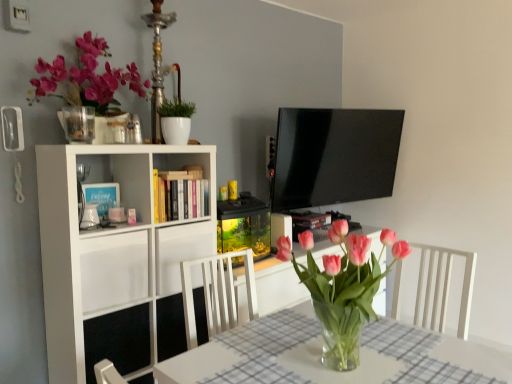
Question: From a real-world perspective, is white glossy pot at upper center above or below pink glass vase at center?

Choices:
 (A) above
 (B) below

Answer: (A)

Question: In the image, is white glossy pot at upper center on the left side or the right side of pink glass vase at center?

Choices:
 (A) right
 (B) left

Answer: (B)

Question: Which is farther from the clear glass vase at center?

Choices:
 (A) matte pink flowers at upper left
 (B) white matte cabinet at left, the first cabinet in the left-to-right sequence
 (C) pink glass vase at center
 (D) hardcover books at center
 (E) white matte cabinet at center, which is the first cabinet from right to left

Answer: (A)

Question: Which of these objects is positioned closest to the white matte bookcase at left?

Choices:
 (A) clear glass vase at upper left
 (B) white glossy pot at upper center
 (C) clear glass vase at center
 (D) white matte cabinet at center, which is the first cabinet from right to left
 (E) white matte cabinet at left, the first cabinet in the left-to-right sequence

Answer: (E)